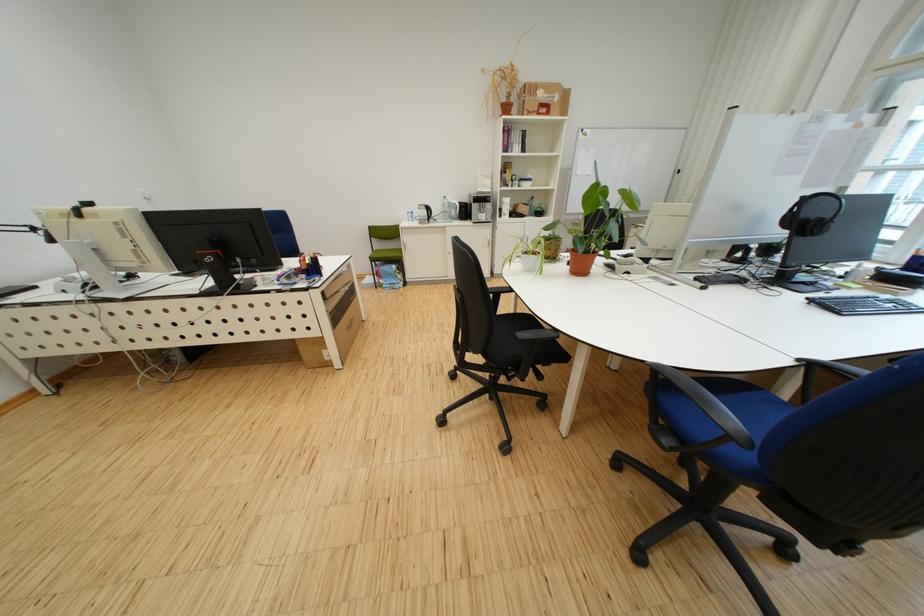
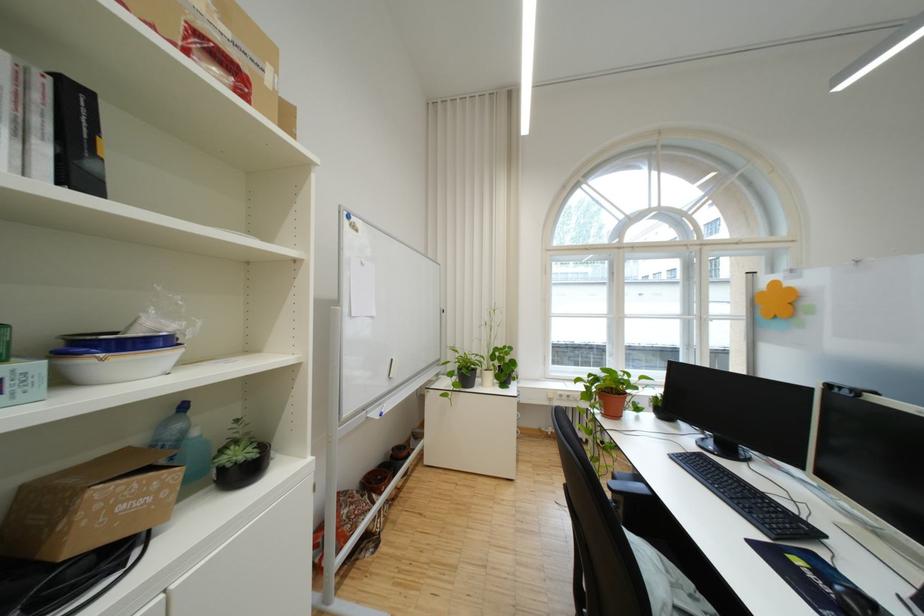
In the second image, find the point that corresponds to point (535, 185) in the first image.

(117, 365)